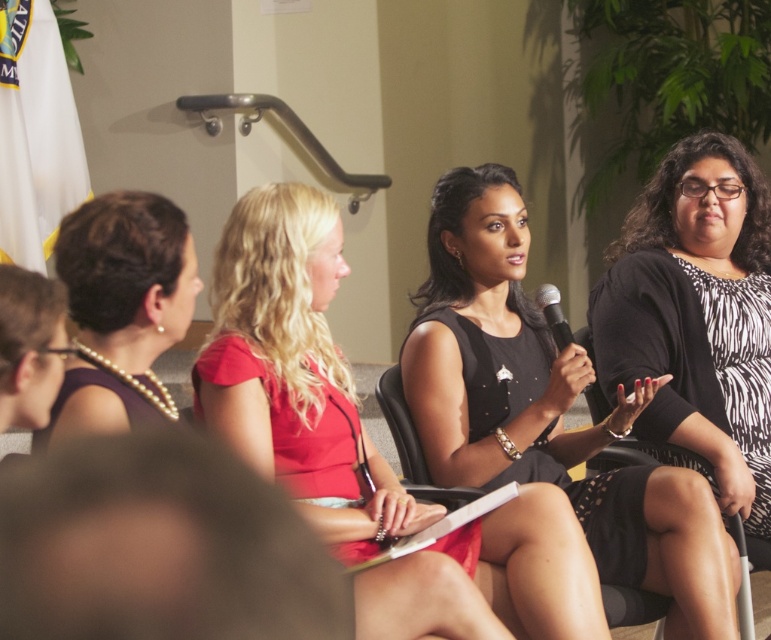
Can you confirm if matte red dress at center is positioned to the left of black metallic microphone at center?

Yes, matte red dress at center is to the left of black metallic microphone at center.

Between matte red dress at center and black metallic microphone at center, which one is positioned lower?

matte red dress at center

Where is `matte red dress at center`? This screenshot has width=771, height=640. matte red dress at center is located at coordinates (295, 371).

Does black dress at center appear on the left side of black zebra-patterned dress at right?

Correct, you'll find black dress at center to the left of black zebra-patterned dress at right.

Locate an element on the screen. The height and width of the screenshot is (640, 771). black dress at center is located at coordinates (547, 410).

Which is behind, point (763, 289) or point (83, 420)?

The point (763, 289) is behind.

Locate an element on the screen. This screenshot has height=640, width=771. black zebra-patterned dress at right is located at coordinates (695, 316).